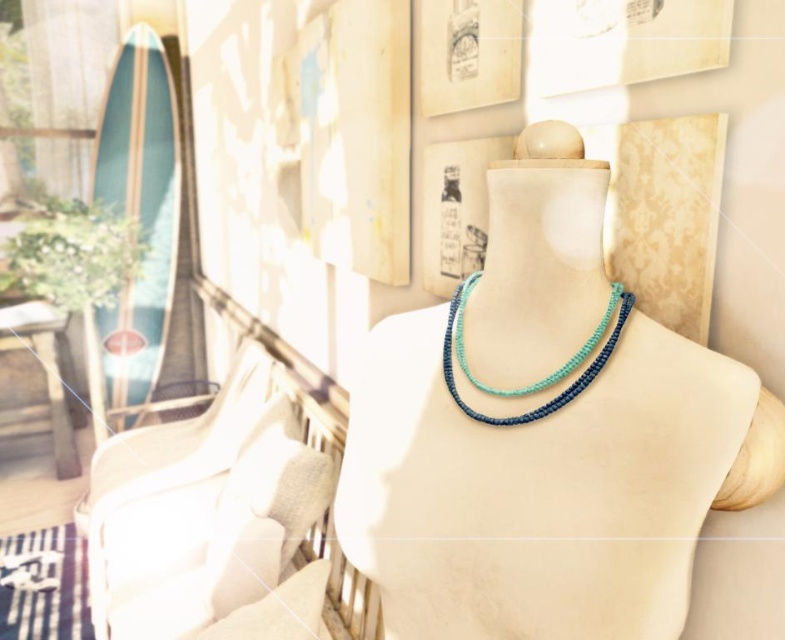
Question: Which of the following is the farthest from the observer?

Choices:
 (A) teal beaded necklace at center
 (B) teal woven necklace at center

Answer: (B)

Question: Among these points, which one is farthest from the camera?

Choices:
 (A) (429, 390)
 (B) (462, 308)

Answer: (B)

Question: Can you confirm if teal beaded necklace at center is smaller than teal woven necklace at center?

Choices:
 (A) yes
 (B) no

Answer: (B)

Question: Does teal beaded necklace at center have a lesser width compared to teal woven necklace at center?

Choices:
 (A) yes
 (B) no

Answer: (B)

Question: Which object appears closest to the camera in this image?

Choices:
 (A) teal woven necklace at center
 (B) teal beaded necklace at center

Answer: (B)

Question: Is teal beaded necklace at center to the left of teal woven necklace at center from the viewer's perspective?

Choices:
 (A) yes
 (B) no

Answer: (B)